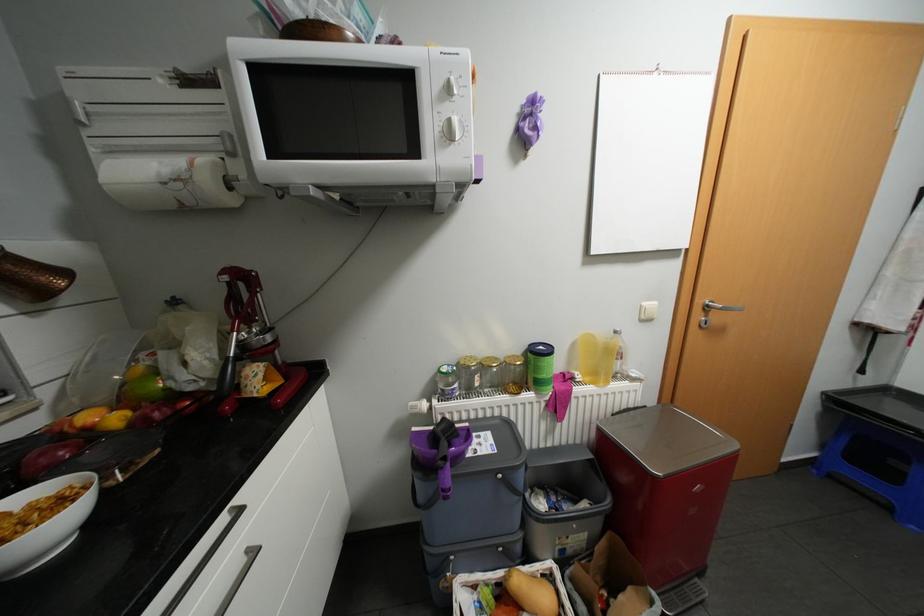
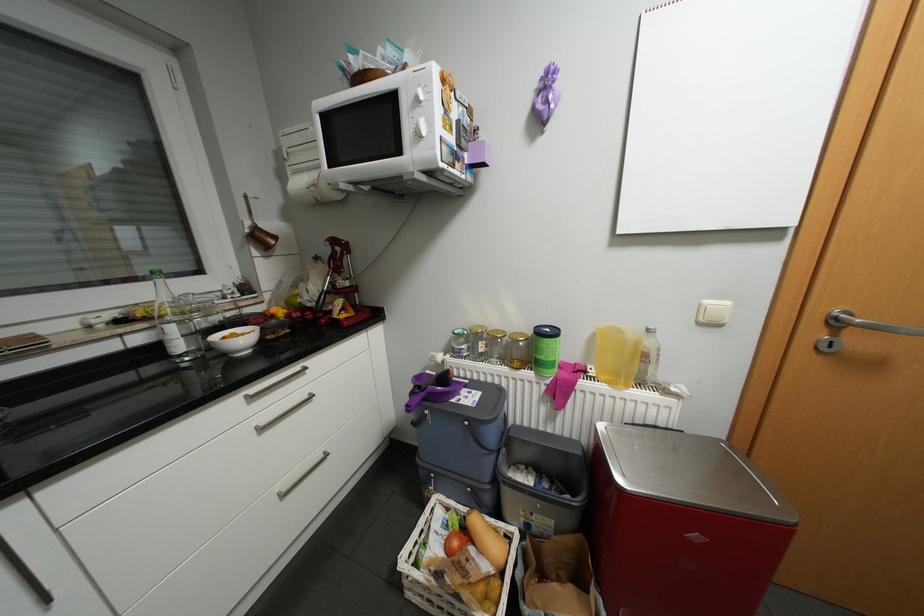
The point at (44, 522) is marked in the first image. Where is the corresponding point in the second image?

(249, 339)